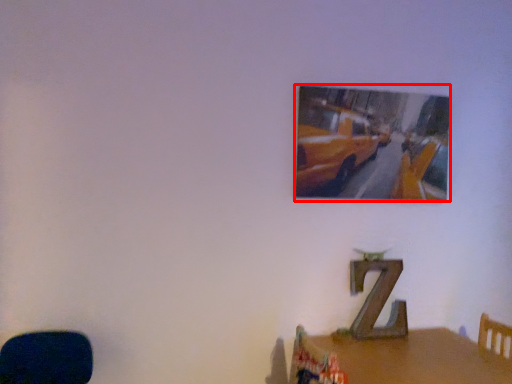
Question: From the image, what is the correct spatial relationship of picture frame (annotated by the red box) in relation to table?

Choices:
 (A) left
 (B) right

Answer: (A)